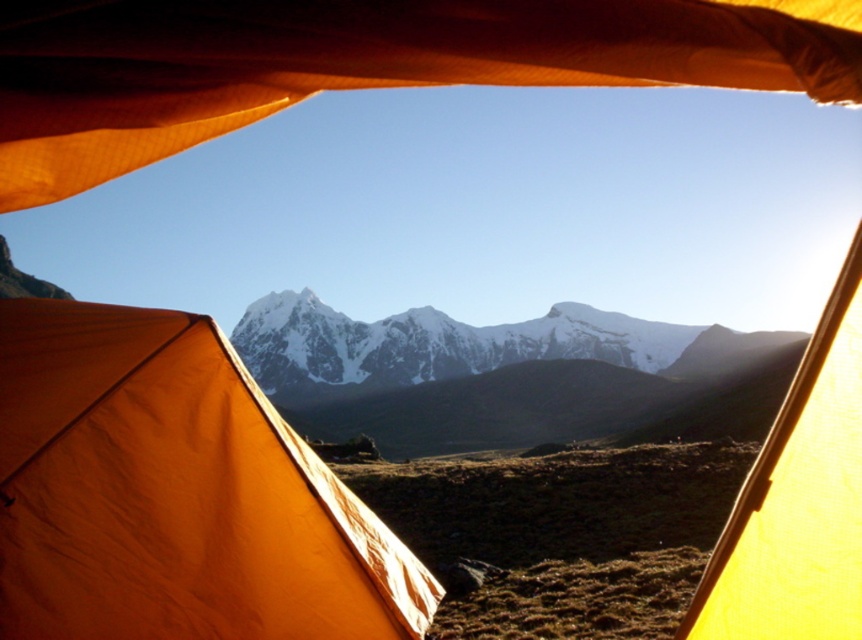
From the picture: You are inside the tent and want to know how far the point at coordinate (x=275, y=486) is from your current position. Can you determine the distance?

The point at coordinate (x=275, y=486) is 132.72 feet away from the camera, so the distance from your current position inside the tent to that point is 132.72 feet.

You are setting up a camera inside the tent to take a photo of the snowy granite mountain range at center. To ensure the orange fabric canopy at upper center doesn not block the view of the mountain range, where should you position the camera relative to the canopy?

The orange fabric canopy at upper center is on the left side of the snowy granite mountain range at center, so positioning the camera to the right of the orange fabric canopy at upper center will keep it out of the frame while capturing the mountain range.

From the picture: You are setting up a camp in the mountains and need to secure a rope between the orange fabric tent at center and the orange fabric canopy at upper center. Which object should you attach the higher end of the rope to?

You should attach the higher end of the rope to the orange fabric canopy at upper center because it is positioned above the orange fabric tent at center.